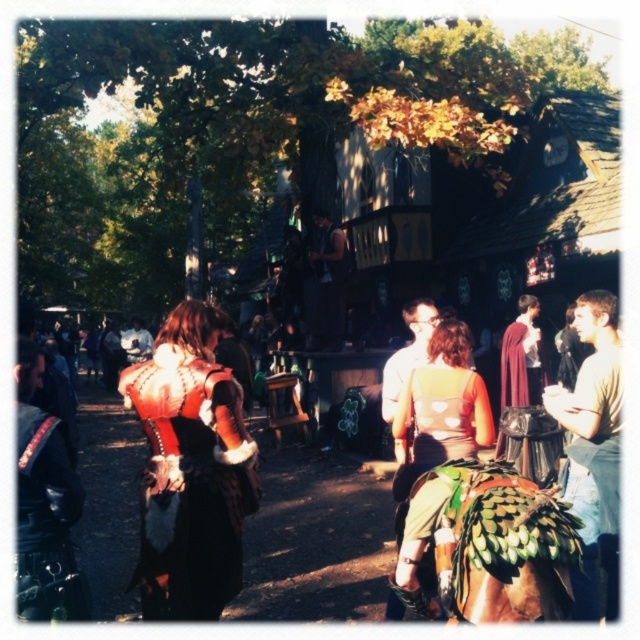
Who is higher up, leather-like brown vest at center or white cotton shirt at right?

white cotton shirt at right is higher up.

This screenshot has width=640, height=640. What do you see at coordinates (189, 468) in the screenshot?
I see `leather-like brown vest at center` at bounding box center [189, 468].

Who is more distant from viewer, [157,584] or [611,502]?

Positioned behind is point [611,502].

Identify the location of leather-like brown vest at center. This screenshot has width=640, height=640. (189, 468).

Can you confirm if green fabric dress at center is bigger than leather jacket at left?

Correct, green fabric dress at center is larger in size than leather jacket at left.

Where is `green fabric dress at center`? green fabric dress at center is located at coordinates (433, 445).

This screenshot has width=640, height=640. I want to click on green fabric dress at center, so click(x=433, y=445).

In the scene shown: Is leather-like brown vest at center to the right of green fabric dress at center from the viewer's perspective?

In fact, leather-like brown vest at center is to the left of green fabric dress at center.

Find the location of a particular element. leather-like brown vest at center is located at coordinates (189, 468).

Between point (177, 396) and point (442, 337), which one is positioned in front?

Point (177, 396) is in front.

What are the coordinates of `leather-like brown vest at center` in the screenshot? It's located at (189, 468).